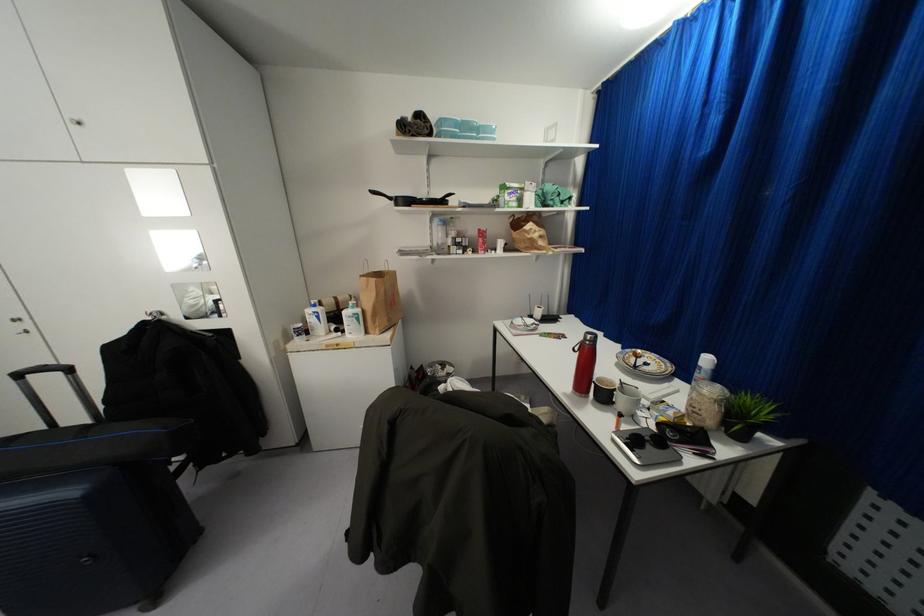
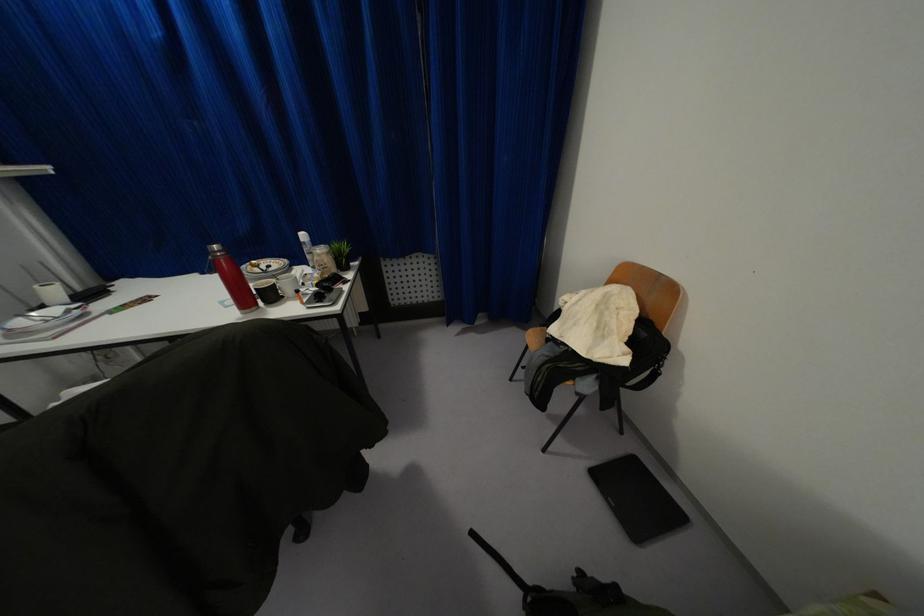
Where in the second image is the point corresponding to pixel 613 403 from the first image?

(282, 296)